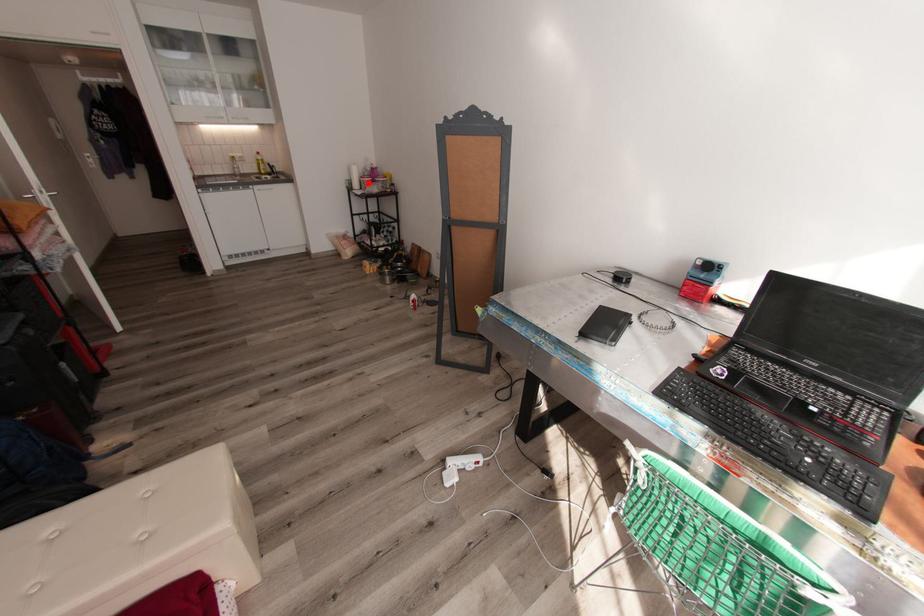
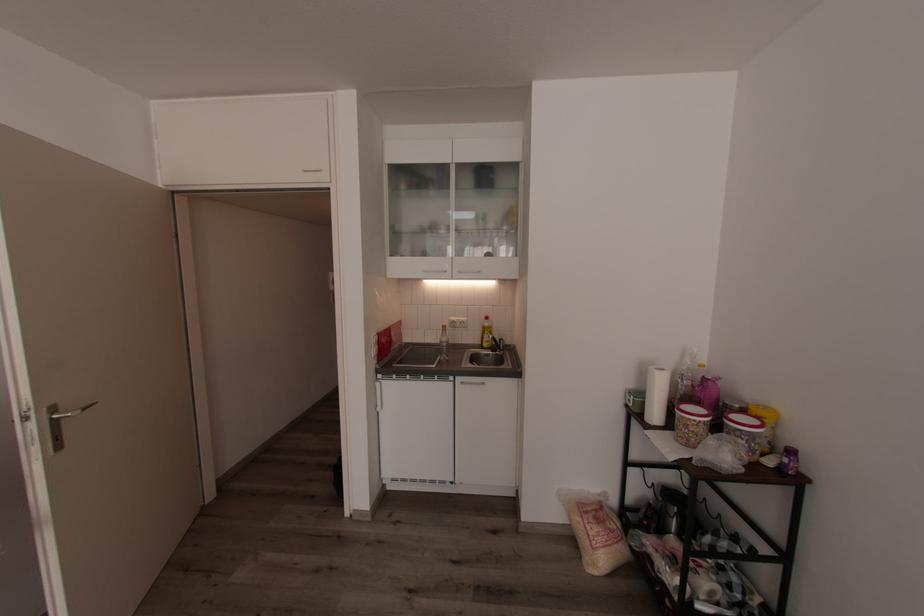
Question: A red point is marked in image1. In image2, is the corresponding 3D point closer to the camera or farther? Reply with the corresponding letter.

Choices:
 (A) The corresponding 3D point is closer.
 (B) The corresponding 3D point is farther.

Answer: (B)